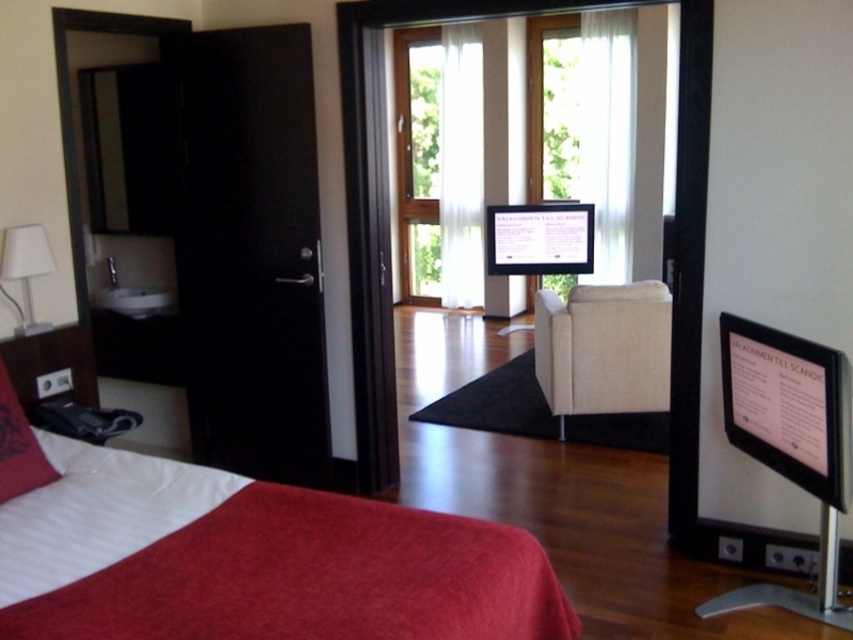
Question: Based on their relative distances, which object is nearer to the velvet red pillow at lower left?

Choices:
 (A) velvet red bed at lower left
 (B) white fabric lampshade at left

Answer: (A)

Question: Which point is farther to the camera?

Choices:
 (A) (7, 492)
 (B) (630, 317)

Answer: (B)

Question: In this image, where is transparent glass door at center located relative to white glossy computer monitor at center?

Choices:
 (A) left
 (B) right

Answer: (A)

Question: Is transparent glass door at center above white glossy computer monitor at center?

Choices:
 (A) yes
 (B) no

Answer: (B)

Question: Considering the real-world distances, which object is closest to the velvet red bed at lower left?

Choices:
 (A) transparent glass door at center
 (B) white fabric lampshade at left
 (C) velvet red pillow at lower left
 (D) black glossy door at left

Answer: (C)

Question: Is velvet red bed at lower left smaller than transparent glass door at center?

Choices:
 (A) yes
 (B) no

Answer: (A)